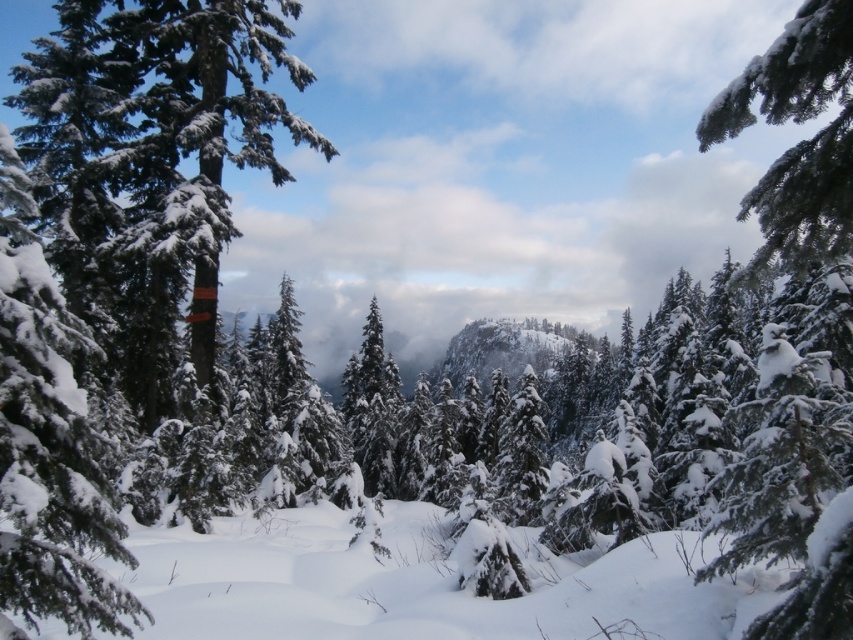
You are standing at the point marked as point (422,582) in the winter landscape. Looking around, you see snow everywhere. Where exactly are you standing?

You are standing on white fluffy snow at center, as the point (422,582) is located there.